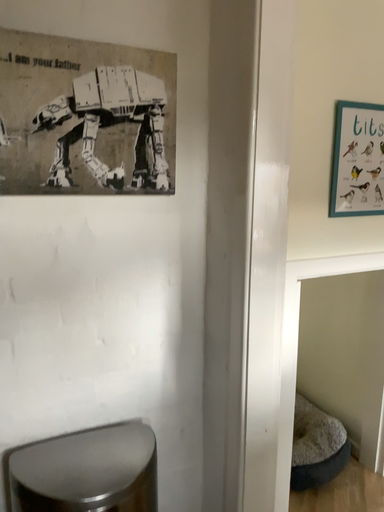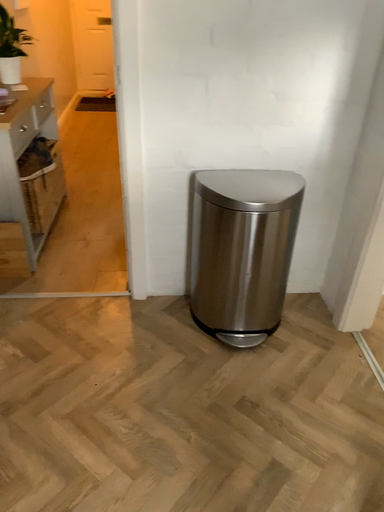
Question: How did the camera likely rotate when shooting the video?

Choices:
 (A) rotated downward
 (B) rotated upward

Answer: (A)